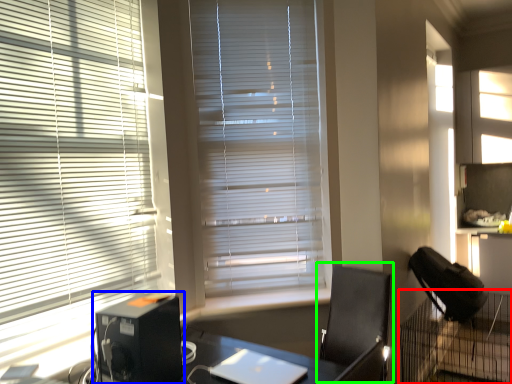
Question: Based on their relative distances, which object is nearer to computer desk (highlighted by a red box)? Choose from computer tower (highlighted by a blue box) and computer chair (highlighted by a green box).

Choices:
 (A) computer tower
 (B) computer chair

Answer: (B)